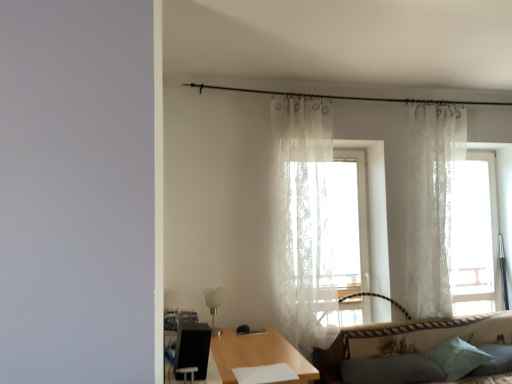
Question: Would you say soft blue pillow at lower right, acting as the third pillow starting from the left, is to the left or to the right of white lace curtain at upper right, which ranks as the 1th curtain in right-to-left order, in the picture?

Choices:
 (A) left
 (B) right

Answer: (B)

Question: Is point (501, 362) positioned closer to the camera than point (459, 150)?

Choices:
 (A) farther
 (B) closer

Answer: (B)

Question: Which object is the farthest from the black textured swivel chair at lower left?

Choices:
 (A) white lace curtain at upper right, which ranks as the 1th curtain in right-to-left order
 (B) wooden table at center
 (C) transparent lace curtain at right
 (D) soft blue pillow at lower right, which is the 1th pillow from right to left
 (E) patterned fabric couch at lower right

Answer: (C)

Question: Which is farther from the dark gray fabric pillow at lower right, acting as the third pillow starting from the right?

Choices:
 (A) black textured swivel chair at lower left
 (B) wooden table at center
 (C) light blue fabric pillow at lower right, the 2th pillow positioned from the left
 (D) sheer white curtain at center, which ranks as the first curtain in left-to-right order
 (E) soft blue pillow at lower right, which is the 1th pillow from right to left

Answer: (A)